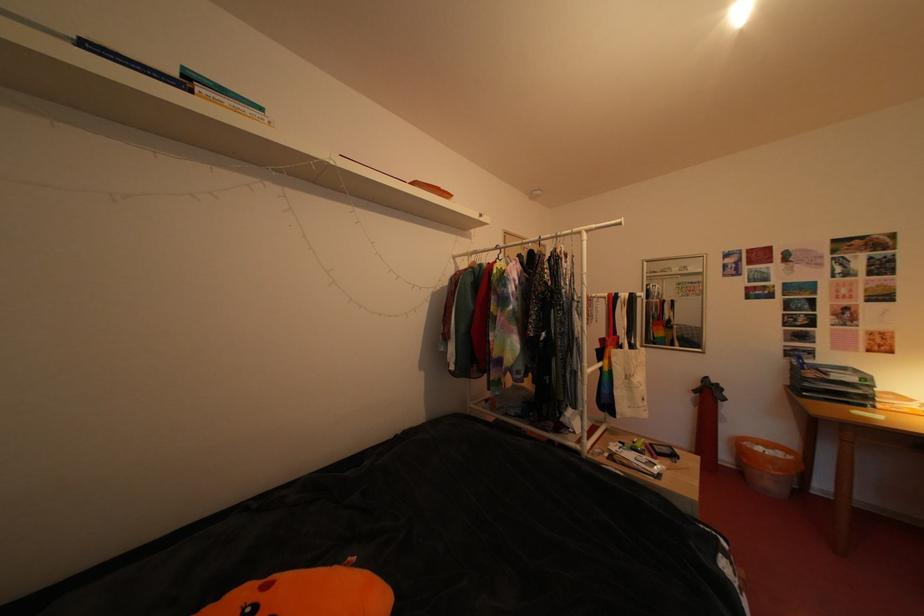
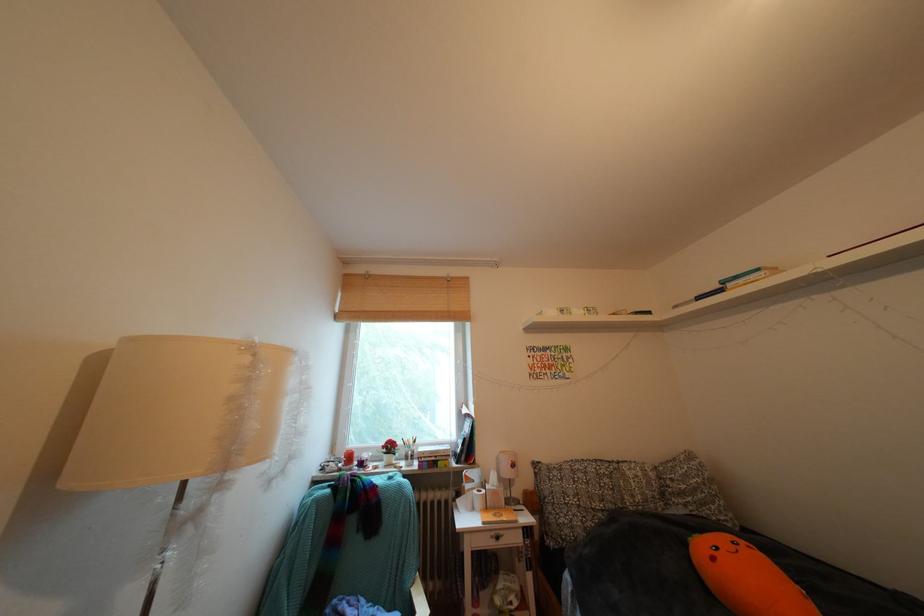
The point at (272, 113) is marked in the first image. Where is the corresponding point in the second image?

(768, 275)